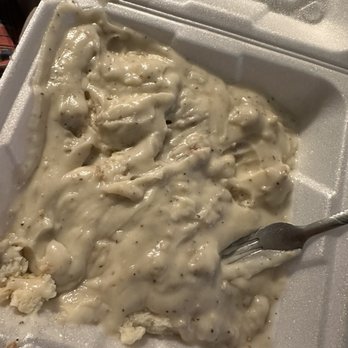
Locate an element on the screen. The width and height of the screenshot is (348, 348). lid of container is located at coordinates (291, 27).